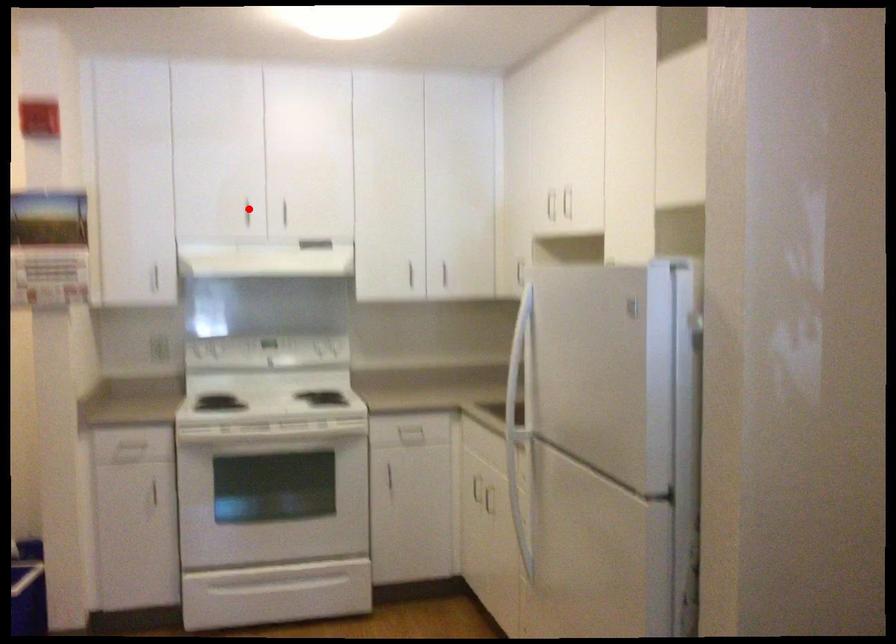
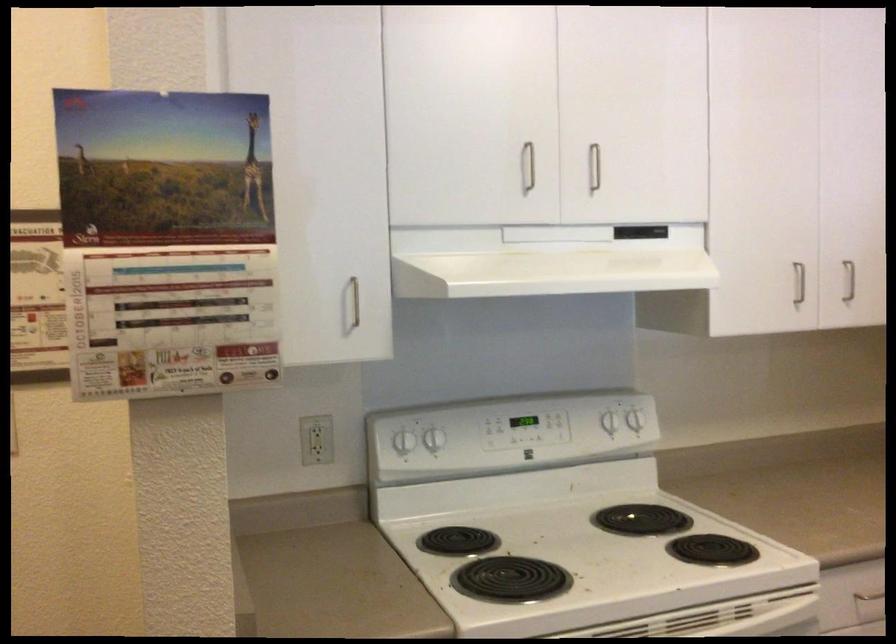
Question: I am providing you with two images of the same scene from different viewpoints. Given a red point in image1, look at the same physical point in image2. Is it:

Choices:
 (A) Closer to the viewpoint
 (B) Farther from the viewpoint

Answer: (A)